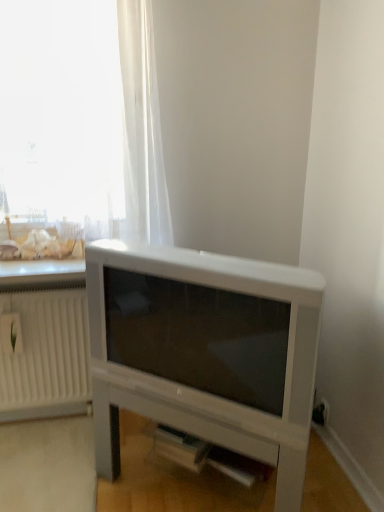
Question: Would you say white matte entertainment center at lower center is to the left or to the right of transparent fabric at upper left in the picture?

Choices:
 (A) left
 (B) right

Answer: (B)

Question: Considering the positions of white matte entertainment center at lower center and transparent fabric at upper left in the image, is white matte entertainment center at lower center bigger or smaller than transparent fabric at upper left?

Choices:
 (A) big
 (B) small

Answer: (A)

Question: Based on their relative distances, which object is nearer to the transparent fabric at upper left?

Choices:
 (A) white plastic radiator at left
 (B) white matte entertainment center at lower center

Answer: (B)

Question: Estimate the real-world distances between objects in this image. Which object is farther from the white plastic radiator at left?

Choices:
 (A) transparent fabric at upper left
 (B) white matte entertainment center at lower center

Answer: (A)